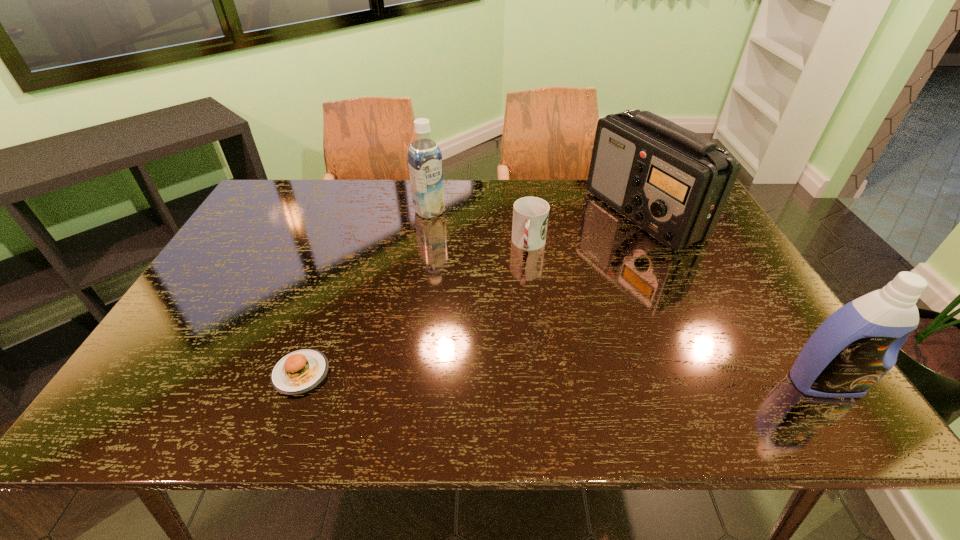
Locate an element on the screen. The image size is (960, 540). the shortest object is located at coordinates (300, 371).

Where is `the leftmost object`? the leftmost object is located at coordinates (300, 371).

I want to click on detergent, so click(858, 344).

At what (x,y) coordinates should I click in order to perform the action: click on the fourth tallest object. Please return your answer as a coordinate pair (x, y). Image resolution: width=960 pixels, height=540 pixels. Looking at the image, I should click on (530, 214).

Locate an element on the screen. The width and height of the screenshot is (960, 540). cup is located at coordinates (530, 214).

Where is `radio receiver`? The width and height of the screenshot is (960, 540). radio receiver is located at coordinates (673, 183).

Image resolution: width=960 pixels, height=540 pixels. In order to click on soya milk in this screenshot , I will do `click(425, 165)`.

Image resolution: width=960 pixels, height=540 pixels. In order to click on vacant region located 0.260m on the right of the leftmost object in this screenshot , I will do pyautogui.click(x=448, y=373).

Identify the location of free spot located on the back of the detergent. (783, 323).

This screenshot has height=540, width=960. What are the coordinates of `vacant space situated on the handle side of the fourth tallest object` in the screenshot? It's located at coord(506,357).